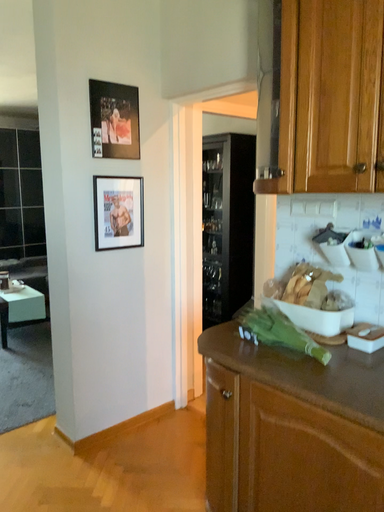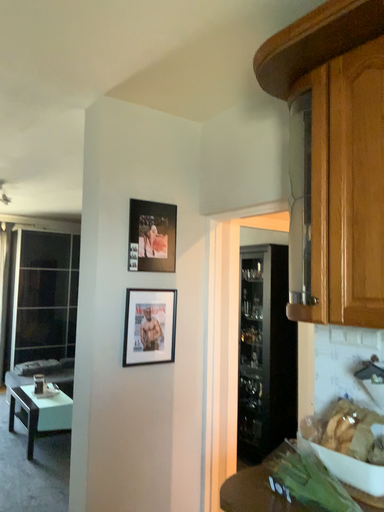
Question: How did the camera likely rotate when shooting the video?

Choices:
 (A) rotated upward
 (B) rotated downward

Answer: (A)